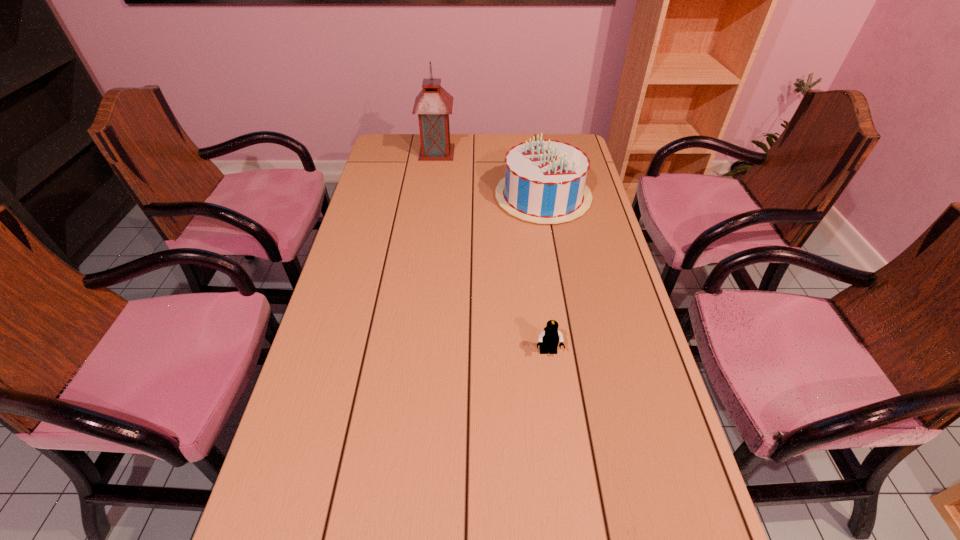
The height and width of the screenshot is (540, 960). I want to click on object present at the right edge, so click(545, 180).

Find the location of a particular element. free space at the far edge is located at coordinates (492, 161).

You are a GUI agent. You are given a task and a screenshot of the screen. Output one action in this format:
    pyautogui.click(x=<x>, y=<y>)
    Task: Click on the vacant space at the left edge of the desktop
    
    Given the screenshot: What is the action you would take?
    pyautogui.click(x=406, y=210)

Locate an element on the screen. The height and width of the screenshot is (540, 960). free space at the right edge is located at coordinates (579, 219).

This screenshot has width=960, height=540. I want to click on unoccupied position between the birthday cake and the farthest object, so click(x=490, y=174).

Find the location of a particular element. free space between the second shortest object and the lantern is located at coordinates (490, 174).

The height and width of the screenshot is (540, 960). In order to click on free spot between the farthest object and the nearest object in this screenshot , I will do `click(492, 252)`.

Identify the location of free area in between the lantern and the shortest object. The image size is (960, 540). (492, 252).

In order to click on vacant point located between the farthest object and the Lego in this screenshot , I will do `click(492, 252)`.

At what (x,y) coordinates should I click in order to perform the action: click on the second closest object to the nearest object. Please return your answer as a coordinate pair (x, y). Looking at the image, I should click on (433, 104).